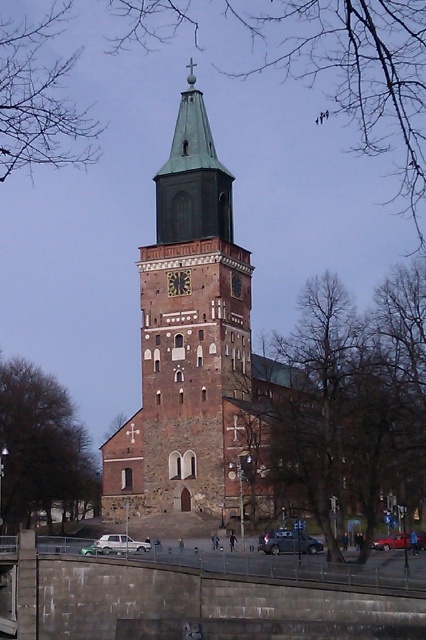
Can you confirm if green copper bell tower at center is positioned above dark brown stone clock at center?

Yes, green copper bell tower at center is above dark brown stone clock at center.

This screenshot has width=426, height=640. What do you see at coordinates (192, 179) in the screenshot?
I see `green copper bell tower at center` at bounding box center [192, 179].

The height and width of the screenshot is (640, 426). I want to click on green copper bell tower at center, so click(192, 179).

Between brown stone church at center and green copper bell tower at center, which one appears on the left side from the viewer's perspective?

Positioned to the left is green copper bell tower at center.

Who is higher up, brown stone church at center or green copper bell tower at center?

Positioned higher is green copper bell tower at center.

Does point (239, 324) lie behind point (193, 128)?

No, it is in front of (193, 128).

At what (x,y) coordinates should I click in order to perform the action: click on brown stone church at center. Please return your answer as a coordinate pair (x, y). Looking at the image, I should click on (195, 352).

Does brown stone church at center come behind dark brown stone clock at center?

No, it is not.

Is brown stone church at center taller than dark brown stone clock at center?

Correct, brown stone church at center is much taller as dark brown stone clock at center.

Is point (180, 397) farther from viewer compared to point (172, 282)?

No, (180, 397) is closer to viewer.

You are a GUI agent. You are given a task and a screenshot of the screen. Output one action in this format:
    pyautogui.click(x=<x>, y=<y>)
    Task: Click on the brown stone church at center
    The width and height of the screenshot is (426, 640).
    Given the screenshot: What is the action you would take?
    pyautogui.click(x=195, y=352)